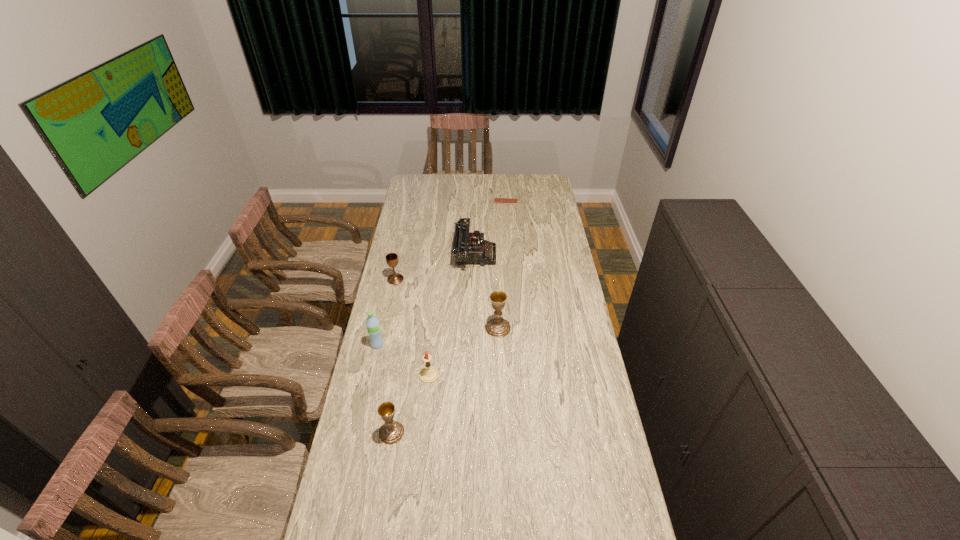
Identify the location of vacant region between the farthest object and the farthest chalice. (450, 240).

This screenshot has height=540, width=960. I want to click on free spot between the tallest chalice and the fifth object from right to left, so click(x=444, y=380).

Locate an element on the screen. The height and width of the screenshot is (540, 960). vacant region between the third nearest object and the fourth nearest object is located at coordinates (438, 336).

Locate an element on the screen. The height and width of the screenshot is (540, 960). empty space between the shortest object and the candle is located at coordinates (468, 288).

Where is `object that is the second closest to the rightmost chalice`? This screenshot has height=540, width=960. object that is the second closest to the rightmost chalice is located at coordinates 468,247.

Select which object appears as the third closest to the typewriter. Please provide its 2D coordinates. Your answer should be formatted as a tuple, i.e. [(x, y)], where the tuple contains the x and y coordinates of a point satisfying the conditions above.

[(496, 200)]

Where is `chalice that can be found as the second closest to the fourth object from right to left`? chalice that can be found as the second closest to the fourth object from right to left is located at coordinates (498, 327).

At what (x,y) coordinates should I click in order to perform the action: click on chalice that stands as the second closest to the candle. Please return your answer as a coordinate pair (x, y). Looking at the image, I should click on (498, 327).

Where is `free spot that satisfies the following two spatial constraints: 1. on the back side of the farthest object; 2. on the left side of the fourth nearest object`? This screenshot has height=540, width=960. free spot that satisfies the following two spatial constraints: 1. on the back side of the farthest object; 2. on the left side of the fourth nearest object is located at coordinates (492, 201).

This screenshot has height=540, width=960. I want to click on vacant area in the image that satisfies the following two spatial constraints: 1. on the keyboard of the typewriter; 2. on the left side of the tallest chalice, so click(x=473, y=328).